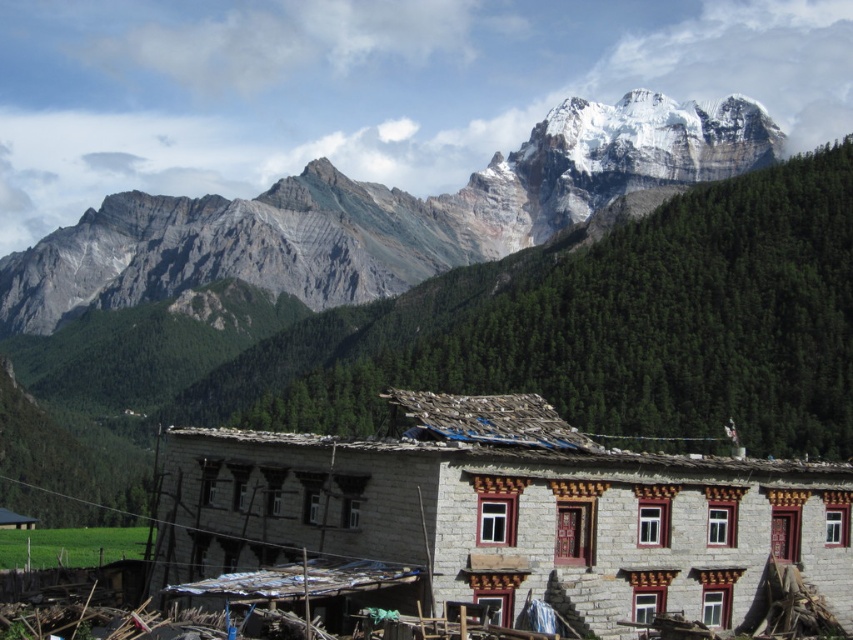
Question: Which object is the farthest from the rustic wooden hut at lower left?

Choices:
 (A) gray rocky mountain range at upper center
 (B) white stone building at center

Answer: (A)

Question: Which point is closer to the camera?

Choices:
 (A) (10, 513)
 (B) (650, 477)
 (C) (78, 253)

Answer: (B)

Question: Does gray rocky mountain range at upper center have a larger size compared to rustic wooden hut at lower left?

Choices:
 (A) yes
 (B) no

Answer: (A)

Question: From the image, what is the correct spatial relationship of white stone building at center in relation to rustic wooden hut at lower left?

Choices:
 (A) above
 (B) below

Answer: (A)

Question: Among these objects, which one is farthest from the camera?

Choices:
 (A) gray rocky mountain range at upper center
 (B) white stone building at center

Answer: (A)

Question: Is white stone building at center positioned behind rustic wooden hut at lower left?

Choices:
 (A) yes
 (B) no

Answer: (B)